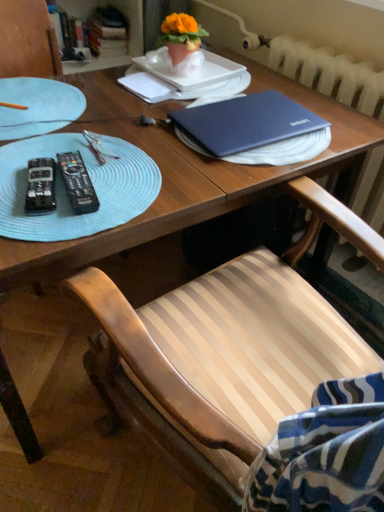
At what (x,y) coordinates should I click in order to perform the action: click on unoccupied area in front of white paper at upper center. Please return your answer as a coordinate pair (x, y). Looking at the image, I should click on (128, 117).